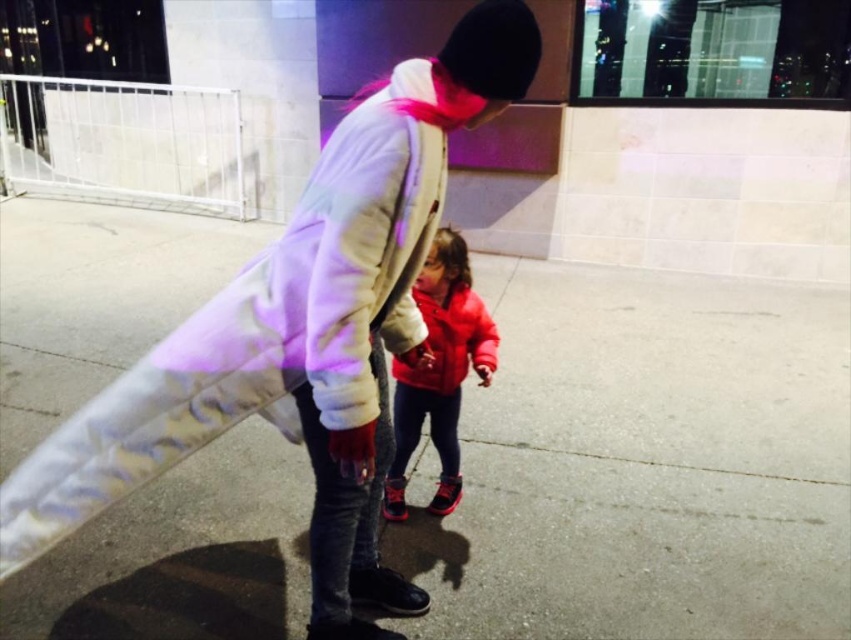
Question: Which point is farther to the camera?

Choices:
 (A) matte red jacket at center
 (B) white fleece jacket at center
 (C) smooth concrete pavement at center
 (D) matte red sweatshirt at center

Answer: (C)

Question: Based on their relative distances, which object is farther from the smooth concrete pavement at center?

Choices:
 (A) white fleece jacket at center
 (B) matte red sweatshirt at center
 (C) matte red jacket at center

Answer: (A)

Question: Can you confirm if matte red jacket at center is thinner than matte red sweatshirt at center?

Choices:
 (A) yes
 (B) no

Answer: (B)

Question: Where is matte red jacket at center located in relation to matte red sweatshirt at center in the image?

Choices:
 (A) below
 (B) above

Answer: (A)

Question: Considering the relative positions of smooth concrete pavement at center and white fleece jacket at center in the image provided, where is smooth concrete pavement at center located with respect to white fleece jacket at center?

Choices:
 (A) left
 (B) right

Answer: (B)

Question: Estimate the real-world distances between objects in this image. Which object is farther from the smooth concrete pavement at center?

Choices:
 (A) matte red sweatshirt at center
 (B) white fleece jacket at center

Answer: (B)